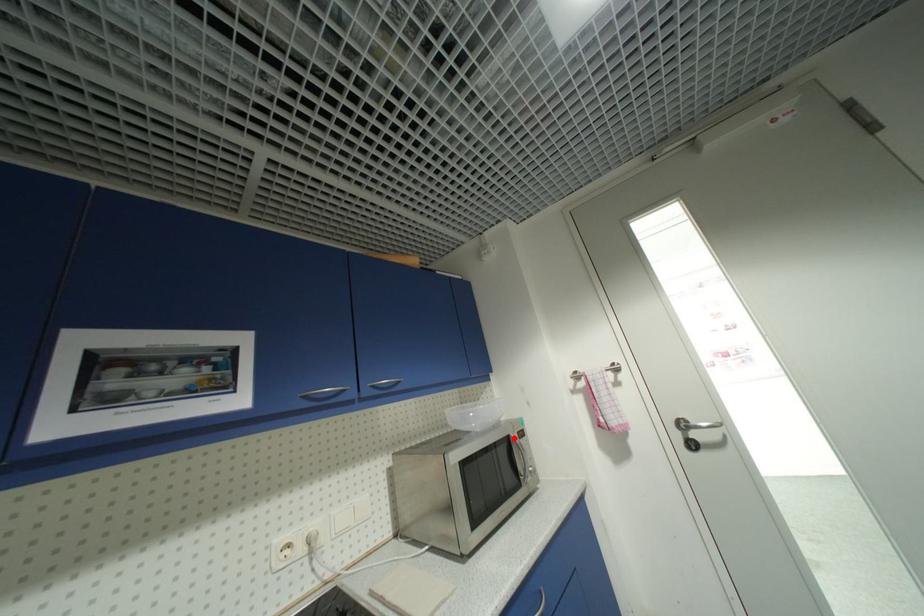
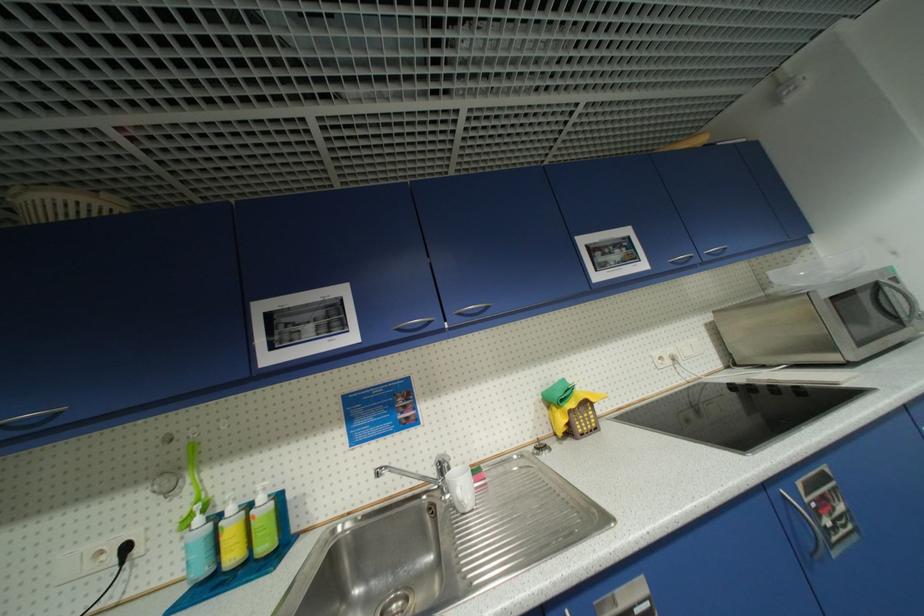
Question: I am providing you with two images of the same scene from different viewpoints. A red point is marked on the first image. At the location where the point appears in image 1, is it still visible in image 2?

Choices:
 (A) Yes
 (B) No

Answer: (A)